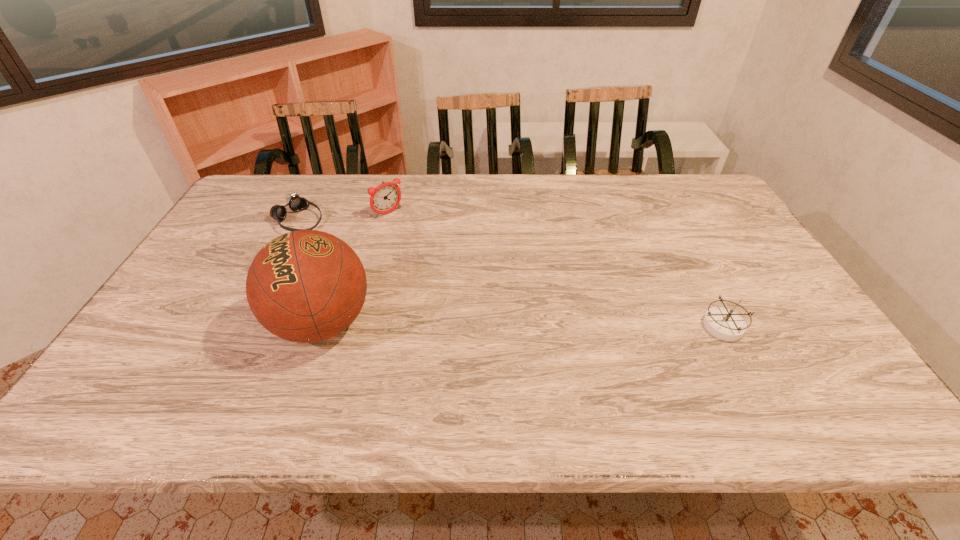
Where is `vacant space on the desktop that is between the basketball and the compass and is positioned on the front-facing side of the alarm clock`? The height and width of the screenshot is (540, 960). vacant space on the desktop that is between the basketball and the compass and is positioned on the front-facing side of the alarm clock is located at coordinates (512, 325).

Identify the location of free spot on the desktop that is between the basketball and the rightmost object and is positioned through the lenses of the goggles. (481, 324).